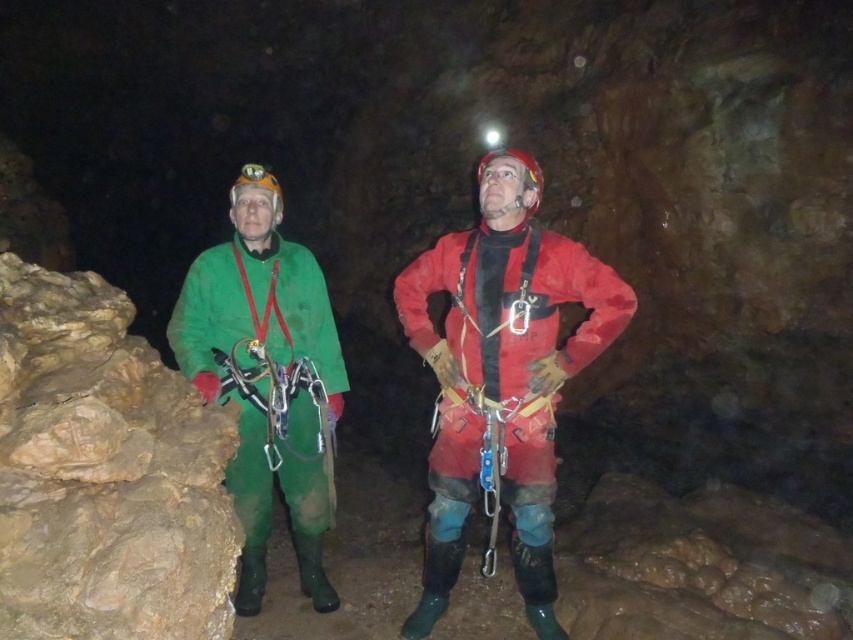
You are standing at the entrance of the cave and want to reach the point marked as point (415, 344). Given that your maximum comfortable walking distance is 10 feet, can you safely walk to that point without exceeding your limit?

The distance between you and point (415, 344) is 9.84 feet, which is within your maximum comfortable walking distance of 10 feet. Therefore, you can safely walk to that point without exceeding your limit.

You are navigating a cave and need to locate the matte red jacket at center. Based on the coordinates provided in the Objects Description, can you determine if it is positioned closer to the left or right side of the image?

The matte red jacket at center is located at point 0.583 on the x and y axis, which places it closer to the right side of the image.

You are a photographer planning to take a photo of the matte red jacket at center and the green matte jacket at left. Which jacket should you focus on first to ensure both are in sharp focus?

The matte red jacket at center is further to the viewer than the green matte jacket at left. To ensure both are in sharp focus, you should focus on the matte red jacket at center first since it is closer to the camera, allowing the depth of field to cover the green matte jacket at left behind it.